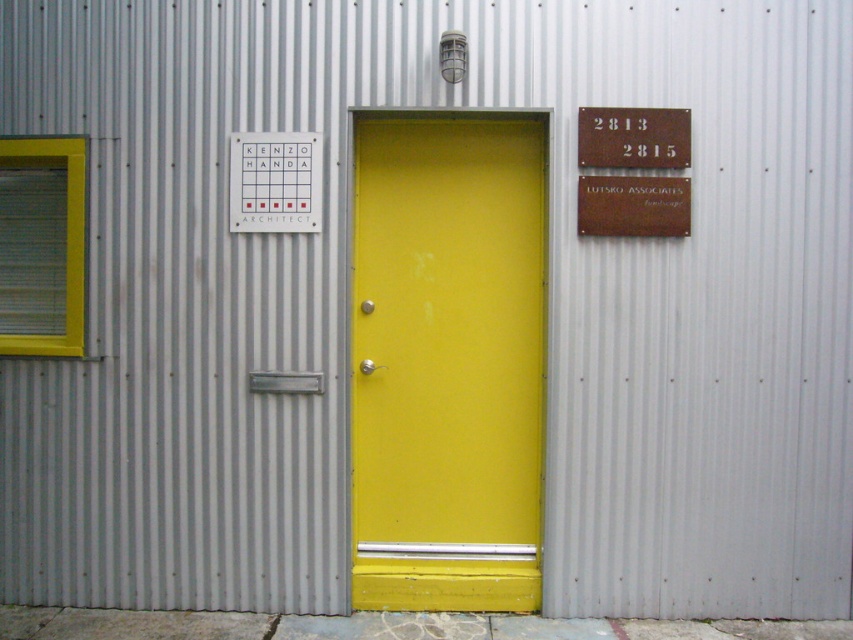
Question: Which of the following is the closest to the observer?

Choices:
 (A) matte white sign at center
 (B) bronze plaque at upper right
 (C) yellow matte door at center
 (D) rusty metal sign at upper right

Answer: (B)

Question: Among these points, which one is nearest to the camera?

Choices:
 (A) [311, 202]
 (B) [367, 602]
 (C) [608, 138]
 (D) [590, 186]

Answer: (C)

Question: From the image, what is the correct spatial relationship of yellow matte door at center in relation to matte white sign at center?

Choices:
 (A) right
 (B) left

Answer: (A)

Question: Is yellow matte door at center closer to camera compared to matte white sign at center?

Choices:
 (A) no
 (B) yes

Answer: (A)

Question: Is rusty metal sign at upper right above bronze plaque at upper right?

Choices:
 (A) yes
 (B) no

Answer: (A)

Question: Which point is closer to the camera taking this photo?

Choices:
 (A) (657, 192)
 (B) (666, 131)
 (C) (389, 136)
 (D) (247, 205)

Answer: (A)